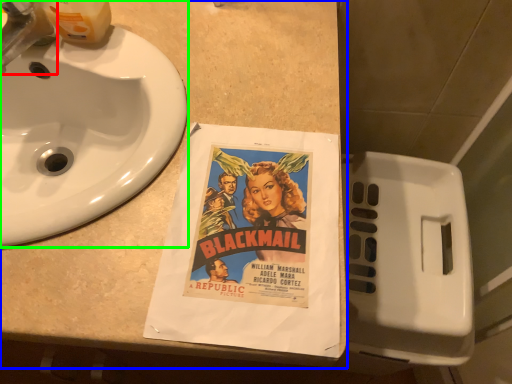
Question: Which object is the closest to the faucet (highlighted by a red box)? Choose among these: counter top (highlighted by a blue box) or sink (highlighted by a green box).

Choices:
 (A) counter top
 (B) sink

Answer: (B)